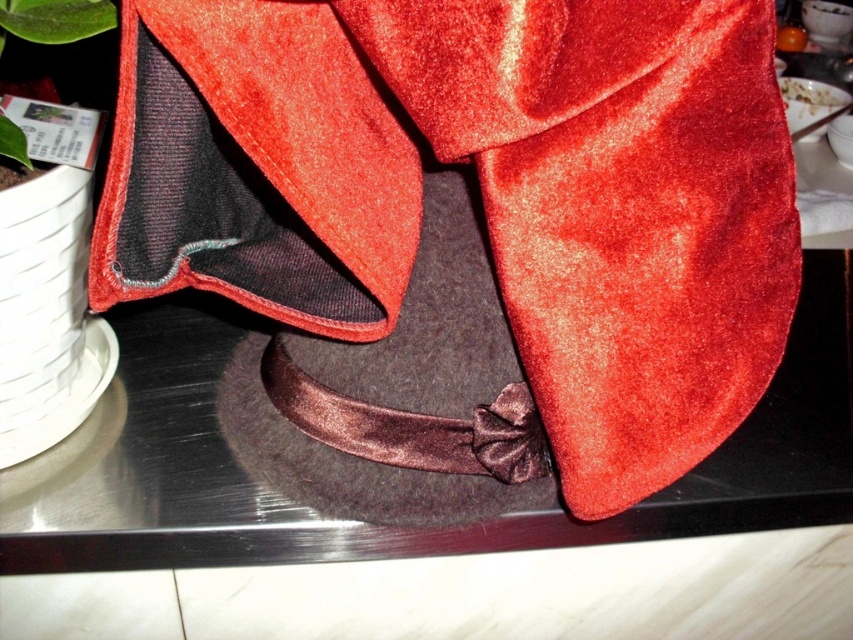
Can you confirm if velvet red cape at center is bigger than green matte leaf at upper left?

Yes, velvet red cape at center is bigger than green matte leaf at upper left.

Who is more forward, [613,40] or [16,132]?

Point [613,40] is in front.

Locate an element on the screen. This screenshot has width=853, height=640. velvet red cape at center is located at coordinates (480, 193).

How much distance is there between green matte leaf at upper left and white creamy food at upper right?

green matte leaf at upper left is 3.93 feet from white creamy food at upper right.

Does green matte leaf at upper left appear over white creamy food at upper right?

Incorrect, green matte leaf at upper left is not positioned above white creamy food at upper right.

Measure the distance between point [93,8] and camera.

Point [93,8] is 24.68 inches away from camera.

Identify the location of green matte leaf at upper left. This screenshot has width=853, height=640. (54, 19).

Which is above, velvet red cape at center or white creamy food at upper right?

white creamy food at upper right is higher up.

Between point (735, 252) and point (824, 100), which one is positioned in front?

Point (735, 252) is more forward.

Is point (543, 76) closer to camera compared to point (824, 88)?

Yes, point (543, 76) is in front of point (824, 88).

You are a GUI agent. You are given a task and a screenshot of the screen. Output one action in this format:
    pyautogui.click(x=<x>, y=<y>)
    Task: Click on the velvet red cape at center
    Image resolution: width=853 pixels, height=640 pixels.
    Given the screenshot: What is the action you would take?
    pyautogui.click(x=480, y=193)